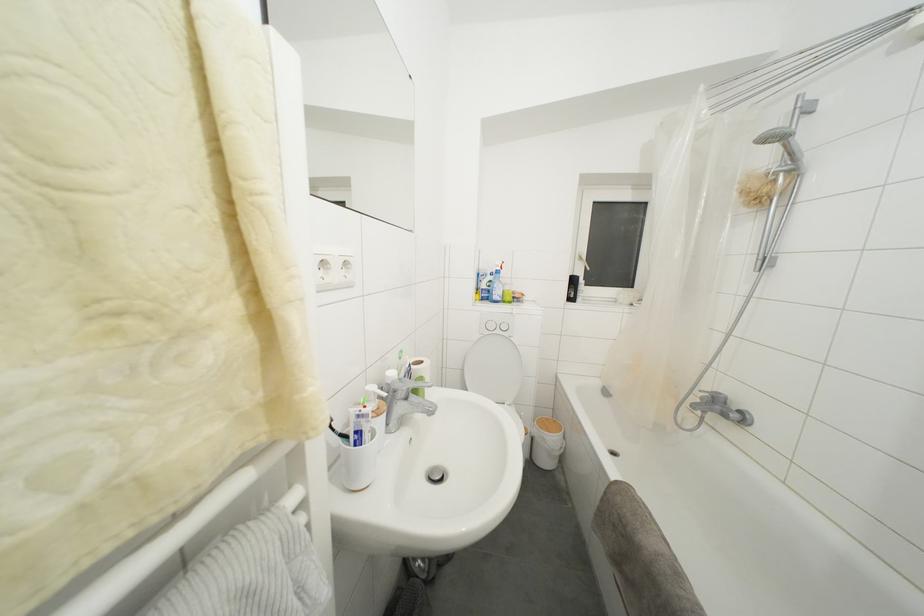
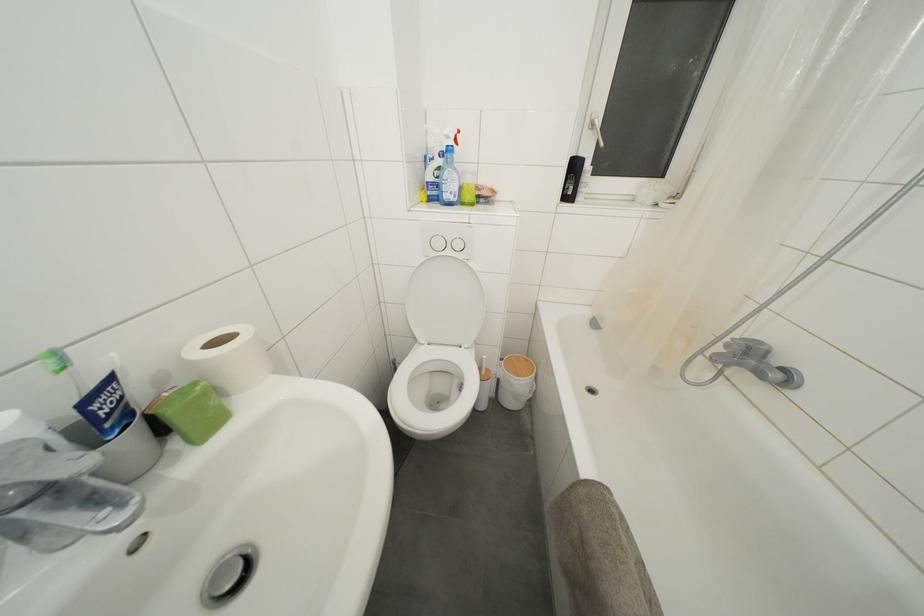
The point at (495,331) is marked in the first image. Where is the corresponding point in the second image?

(443, 249)